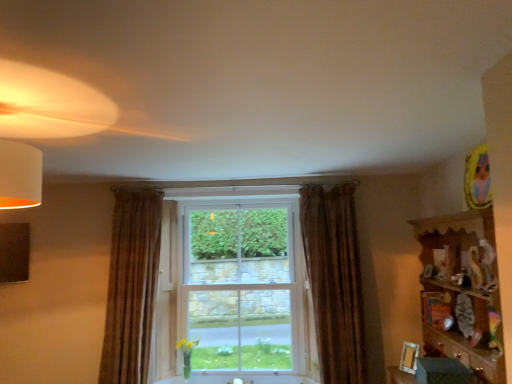
Locate an element on the screen. This screenshot has width=512, height=384. brown velvet curtain at center, arranged as the 2th curtain when viewed from the left is located at coordinates (334, 280).

Measure the distance between point [483,332] and camera.

The distance of point [483,332] from camera is 7.52 feet.

This screenshot has width=512, height=384. In order to click on clear glass window at center in this screenshot , I will do `click(243, 287)`.

Based on the photo, what's the angular difference between brown velvet curtain at center, arranged as the 2th curtain when viewed from the left, and wooden picture frame at lower right's facing directions?

The facing directions of brown velvet curtain at center, arranged as the 2th curtain when viewed from the left, and wooden picture frame at lower right are 57.9 degrees apart.

Between brown velvet curtain at center, arranged as the 1th curtain when viewed from the right, and wooden picture frame at lower right, which one is positioned behind?

brown velvet curtain at center, arranged as the 1th curtain when viewed from the right.

Can you confirm if brown velvet curtain at center, arranged as the 1th curtain when viewed from the right, is wider than wooden picture frame at lower right?

Yes, brown velvet curtain at center, arranged as the 1th curtain when viewed from the right, is wider than wooden picture frame at lower right.

Can you confirm if brown velvet curtain at center, arranged as the 2th curtain when viewed from the left, is positioned to the right of wooden picture frame at lower right?

Incorrect, brown velvet curtain at center, arranged as the 2th curtain when viewed from the left, is not on the right side of wooden picture frame at lower right.

From a real-world perspective, is wooden shelf at right positioned above or below brown textured curtain at left, arranged as the 1th curtain when viewed from the left?

From a real-world perspective, wooden shelf at right is physically below brown textured curtain at left, arranged as the 1th curtain when viewed from the left.

Can you tell me how much wooden shelf at right and brown textured curtain at left, arranged as the 1th curtain when viewed from the left, differ in facing direction?

The angle between the facing direction of wooden shelf at right and the facing direction of brown textured curtain at left, arranged as the 1th curtain when viewed from the left, is 86.7 degrees.

From the image's perspective, is wooden shelf at right under brown textured curtain at left, arranged as the 1th curtain when viewed from the left?

No.

Is point (415, 373) positioned in front of point (326, 207)?

Yes, point (415, 373) is closer to viewer.

From a real-world perspective, between wooden picture frame at lower right and brown velvet curtain at center, arranged as the 2th curtain when viewed from the left, who is vertically higher?

From a 3D spatial view, brown velvet curtain at center, arranged as the 2th curtain when viewed from the left, is above.

Is wooden picture frame at lower right smaller than brown velvet curtain at center, arranged as the 2th curtain when viewed from the left?

Yes, wooden picture frame at lower right is smaller than brown velvet curtain at center, arranged as the 2th curtain when viewed from the left.

Measure the distance between wooden picture frame at lower right and brown velvet curtain at center, arranged as the 2th curtain when viewed from the left.

They are 29.75 inches apart.

Based on the photo, between wooden picture frame at lower right and wooden shelf at right, which one has smaller width?

wooden picture frame at lower right is thinner.

Looking at this image, is wooden picture frame at lower right to the right of wooden shelf at right from the viewer's perspective?

Incorrect, wooden picture frame at lower right is not on the right side of wooden shelf at right.

What are the coordinates of `picture frame lying behind the wooden shelf at right` in the screenshot? It's located at (409, 357).

Is wooden picture frame at lower right taller or shorter than wooden shelf at right?

wooden picture frame at lower right is shorter than wooden shelf at right.

Between clear glass window at center and brown textured curtain at left, arranged as the 1th curtain when viewed from the left, which one has smaller width?

clear glass window at center is thinner.

The image size is (512, 384). Find the location of `window located behind the brown textured curtain at left, which is the second curtain from right to left`. window located behind the brown textured curtain at left, which is the second curtain from right to left is located at coordinates (243, 287).

Based on their sizes in the image, would you say clear glass window at center is bigger or smaller than brown textured curtain at left, which is the second curtain from right to left?

In the image, clear glass window at center appears to be larger than brown textured curtain at left, which is the second curtain from right to left.

Looking at this image, from the image's perspective, between clear glass window at center and brown textured curtain at left, arranged as the 1th curtain when viewed from the left, which one is located above?

brown textured curtain at left, arranged as the 1th curtain when viewed from the left.

Considering the sizes of wooden picture frame at lower right and brown textured curtain at left, which is the second curtain from right to left, in the image, is wooden picture frame at lower right taller or shorter than brown textured curtain at left, which is the second curtain from right to left,?

Considering their sizes, wooden picture frame at lower right has less height than brown textured curtain at left, which is the second curtain from right to left.

Between wooden picture frame at lower right and brown textured curtain at left, which is the second curtain from right to left, which one has smaller size?

With smaller size is wooden picture frame at lower right.

Is point (414, 353) positioned in front of point (159, 210)?

Yes.

Does wooden picture frame at lower right come in front of brown textured curtain at left, arranged as the 1th curtain when viewed from the left?

Yes, the depth of wooden picture frame at lower right is less than that of brown textured curtain at left, arranged as the 1th curtain when viewed from the left.

Is brown textured curtain at left, arranged as the 1th curtain when viewed from the left, thinner than brown velvet curtain at center, arranged as the 2th curtain when viewed from the left?

Yes.

From a real-world perspective, does brown textured curtain at left, arranged as the 1th curtain when viewed from the left, stand above brown velvet curtain at center, arranged as the 1th curtain when viewed from the right?

Indeed, from a real-world perspective, brown textured curtain at left, arranged as the 1th curtain when viewed from the left, stands above brown velvet curtain at center, arranged as the 1th curtain when viewed from the right.

Looking at the image, does brown textured curtain at left, arranged as the 1th curtain when viewed from the left, seem bigger or smaller compared to brown velvet curtain at center, arranged as the 2th curtain when viewed from the left?

In the image, brown textured curtain at left, arranged as the 1th curtain when viewed from the left, appears to be smaller than brown velvet curtain at center, arranged as the 2th curtain when viewed from the left.

Is brown textured curtain at left, which is the second curtain from right to left, outside of brown velvet curtain at center, arranged as the 2th curtain when viewed from the left?

brown textured curtain at left, which is the second curtain from right to left, lies outside brown velvet curtain at center, arranged as the 2th curtain when viewed from the left,'s area.

This screenshot has height=384, width=512. Identify the location of the 2nd curtain above when counting from the wooden picture frame at lower right (from the image's perspective). (334, 280).

The image size is (512, 384). Identify the location of dresser that is on the right side of brown textured curtain at left, arranged as the 1th curtain when viewed from the left. (462, 291).

When comparing their distances from clear glass window at center, does brown velvet curtain at center, arranged as the 2th curtain when viewed from the left, or wooden picture frame at lower right seem further?

wooden picture frame at lower right is positioned further to the anchor clear glass window at center.

Considering their positions, is wooden shelf at right positioned closer to brown textured curtain at left, arranged as the 1th curtain when viewed from the left, than brown velvet curtain at center, arranged as the 2th curtain when viewed from the left?

brown velvet curtain at center, arranged as the 2th curtain when viewed from the left, is closer to brown textured curtain at left, arranged as the 1th curtain when viewed from the left.

Estimate the real-world distances between objects in this image. Which object is further from brown textured curtain at left, arranged as the 1th curtain when viewed from the left, clear glass window at center or wooden picture frame at lower right?

Based on the image, wooden picture frame at lower right appears to be further to brown textured curtain at left, arranged as the 1th curtain when viewed from the left.

Considering their positions, is wooden picture frame at lower right positioned closer to clear glass window at center than brown textured curtain at left, arranged as the 1th curtain when viewed from the left?

brown textured curtain at left, arranged as the 1th curtain when viewed from the left, is closer to clear glass window at center.

Based on their spatial positions, is wooden shelf at right or brown textured curtain at left, arranged as the 1th curtain when viewed from the left, closer to clear glass window at center?

brown textured curtain at left, arranged as the 1th curtain when viewed from the left, lies closer to clear glass window at center than the other object.

When comparing their distances from clear glass window at center, does brown textured curtain at left, which is the second curtain from right to left, or brown velvet curtain at center, arranged as the 1th curtain when viewed from the right, seem further?

brown textured curtain at left, which is the second curtain from right to left, is positioned further to the anchor clear glass window at center.

Looking at the image, which one is located closer to brown textured curtain at left, which is the second curtain from right to left, clear glass window at center or brown velvet curtain at center, arranged as the 2th curtain when viewed from the left?

Answer: clear glass window at center lies closer to brown textured curtain at left, which is the second curtain from right to left, than the other object.

Based on the photo, when comparing their distances from wooden shelf at right, does brown velvet curtain at center, arranged as the 2th curtain when viewed from the left, or wooden picture frame at lower right seem further?

brown velvet curtain at center, arranged as the 2th curtain when viewed from the left.

You are a GUI agent. You are given a task and a screenshot of the screen. Output one action in this format:
    pyautogui.click(x=<x>, y=<y>)
    Task: Click on the window between brown textured curtain at left, which is the second curtain from right to left, and wooden shelf at right, in the horizontal direction
    Image resolution: width=512 pixels, height=384 pixels.
    Given the screenshot: What is the action you would take?
    pyautogui.click(x=243, y=287)

Image resolution: width=512 pixels, height=384 pixels. Identify the location of picture frame between wooden shelf at right and brown velvet curtain at center, arranged as the 1th curtain when viewed from the right, along the z-axis. (409, 357).

Where is `window between brown textured curtain at left, which is the second curtain from right to left, and wooden picture frame at lower right`? window between brown textured curtain at left, which is the second curtain from right to left, and wooden picture frame at lower right is located at coordinates (243, 287).

Where is `curtain between clear glass window at center and wooden picture frame at lower right in the horizontal direction`? The image size is (512, 384). curtain between clear glass window at center and wooden picture frame at lower right in the horizontal direction is located at coordinates (334, 280).